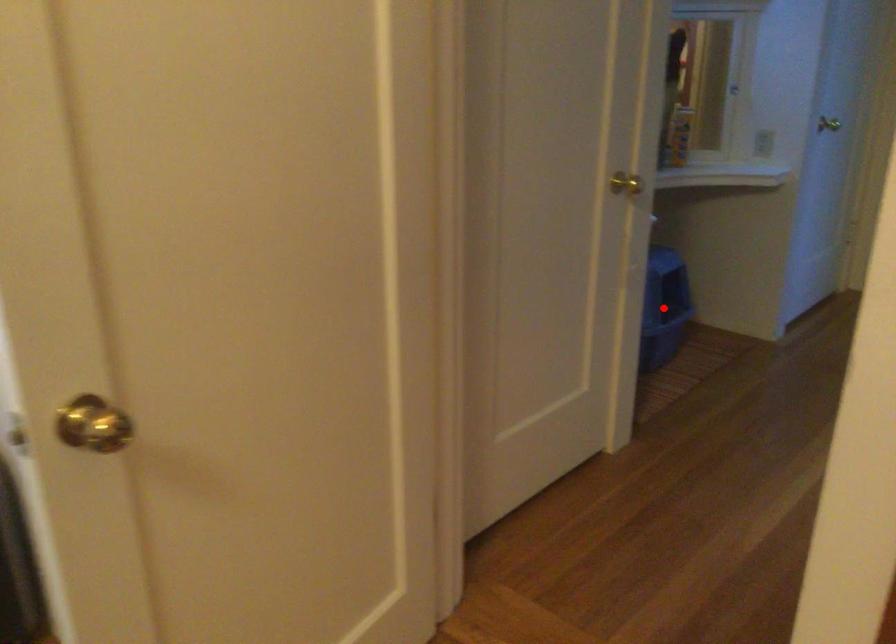
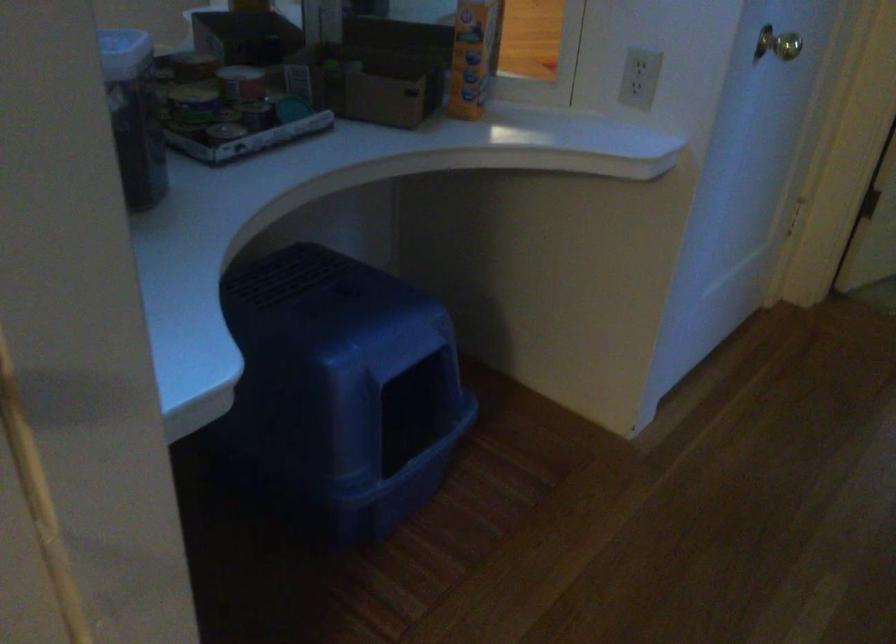
Find the pixel in the second image that matches the highlighted location in the first image.

(451, 371)